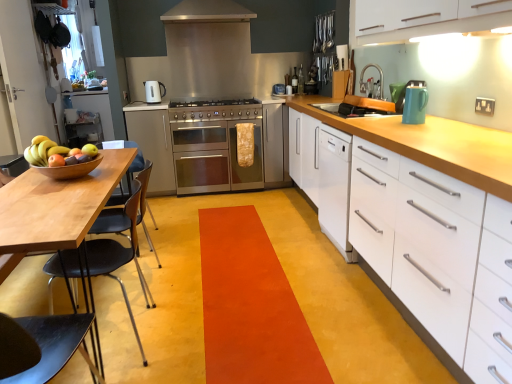
Image resolution: width=512 pixels, height=384 pixels. Identify the location of white matte cabinet at right, positioned as the first cabinetry in right-to-left order. (432, 144).

Image resolution: width=512 pixels, height=384 pixels. Describe the element at coordinates (432, 144) in the screenshot. I see `white matte cabinet at right, the 3th cabinetry from the left` at that location.

What do you see at coordinates (153, 144) in the screenshot?
I see `stainless steel oven at center, placed as the second cabinetry when sorted from front to back` at bounding box center [153, 144].

What is the approximate width of brushed metal faucet at upper center?

brushed metal faucet at upper center is 6.43 inches in width.

Find the location of `white matte cabinet at right, the 3th cabinetry from the left`. white matte cabinet at right, the 3th cabinetry from the left is located at coordinates (432, 144).

Which of these two, white matte dishwasher at center-right or white matte cabinet at right, positioned as the 3th cabinetry in back-to-front order, is smaller?

Smaller between the two is white matte dishwasher at center-right.

How many degrees apart are the facing directions of white matte dishwasher at center-right and white matte cabinet at right, the 3th cabinetry from the left?

white matte dishwasher at center-right and white matte cabinet at right, the 3th cabinetry from the left, are facing 0.000287 degrees away from each other.

Does point (319, 208) appear closer or farther from the camera than point (446, 359)?

Point (319, 208).

What's the angular difference between white glossy electric kettle at upper center, which ranks as the second kitchen appliance in bottom-to-top order, and black plastic chair at left's facing directions?

white glossy electric kettle at upper center, which ranks as the second kitchen appliance in bottom-to-top order, and black plastic chair at left are facing 91.6 degrees away from each other.

The image size is (512, 384). I want to click on chair below the white glossy electric kettle at upper center, which is the 2th kitchen appliance in front-to-back order (from the image's perspective), so click(x=118, y=253).

From the image's perspective, is white glossy electric kettle at upper center, the first kitchen appliance from the left, on black plastic chair at left?

Yes, from the image's perspective, white glossy electric kettle at upper center, the first kitchen appliance from the left, is above black plastic chair at left.

Does orange carpet at center have a larger size compared to teal glossy kettle at upper right, the 2th kitchen appliance positioned from the top?

Indeed, orange carpet at center has a larger size compared to teal glossy kettle at upper right, the 2th kitchen appliance positioned from the top.

Measure the distance from orange carpet at center to teal glossy kettle at upper right, positioned as the first kitchen appliance in bottom-to-top order.

4.42 feet.

Could you tell me if orange carpet at center is facing teal glossy kettle at upper right, which is counted as the first kitchen appliance, starting from the right?

No, orange carpet at center is not oriented towards teal glossy kettle at upper right, which is counted as the first kitchen appliance, starting from the right.

Find the location of a particular element. This screenshot has height=384, width=512. the 1st kitchen appliance above when counting from the orange carpet at center (from the image's perspective) is located at coordinates (415, 102).

In the image, there is a white glossy electric kettle at upper center, which ranks as the second kitchen appliance in bottom-to-top order. At what (x,y) coordinates should I click in order to perform the action: click on sink below it (from the image's perspective). Please return your answer as a coordinate pair (x, y). Looking at the image, I should click on (358, 107).

Is wooden cutting board at upper right oriented away from white glossy electric kettle at upper center, which appears as the 1th kitchen appliance when viewed from the top?

No, wooden cutting board at upper right's orientation is not away from white glossy electric kettle at upper center, which appears as the 1th kitchen appliance when viewed from the top.

Which of these two, wooden cutting board at upper right or white glossy electric kettle at upper center, the first kitchen appliance from the left, is thinner?

Thinner between the two is white glossy electric kettle at upper center, the first kitchen appliance from the left.

Would you consider wooden cutting board at upper right to be distant from white glossy electric kettle at upper center, which is the 2th kitchen appliance in front-to-back order?

Yes.

Considering the sizes of objects wooden bowl at left and white matte cabinet at right, positioned as the 3th cabinetry in back-to-front order, in the image provided, who is shorter, wooden bowl at left or white matte cabinet at right, positioned as the 3th cabinetry in back-to-front order,?

wooden bowl at left is shorter.

From the image's perspective, which one is positioned lower, wooden bowl at left or white matte cabinet at right, positioned as the 3th cabinetry in back-to-front order?

white matte cabinet at right, positioned as the 3th cabinetry in back-to-front order, is shown below in the image.

Based on the photo, is wooden bowl at left aimed at white matte cabinet at right, the 3th cabinetry from the left?

Yes, wooden bowl at left is aimed at white matte cabinet at right, the 3th cabinetry from the left.

Are wooden bowl at left and white matte cabinet at right, positioned as the 3th cabinetry in back-to-front order, far apart?

Yes, wooden bowl at left and white matte cabinet at right, positioned as the 3th cabinetry in back-to-front order, are located far from each other.

How many degrees apart are the facing directions of teal glossy kettle at upper right, the 1th kitchen appliance in the front-to-back sequence, and wooden cutting board at upper right?

There is a 0.00101-degree angle between the facing directions of teal glossy kettle at upper right, the 1th kitchen appliance in the front-to-back sequence, and wooden cutting board at upper right.

Does teal glossy kettle at upper right, the 1th kitchen appliance in the front-to-back sequence, have a lesser width compared to wooden cutting board at upper right?

Indeed, teal glossy kettle at upper right, the 1th kitchen appliance in the front-to-back sequence, has a lesser width compared to wooden cutting board at upper right.

Is teal glossy kettle at upper right, positioned as the first kitchen appliance in bottom-to-top order, to the left or to the right of wooden cutting board at upper right in the image?

From the image, it's evident that teal glossy kettle at upper right, positioned as the first kitchen appliance in bottom-to-top order, is to the right of wooden cutting board at upper right.

Considering the sizes of objects teal glossy kettle at upper right, acting as the second kitchen appliance starting from the left, and wooden cutting board at upper right in the image provided, who is taller, teal glossy kettle at upper right, acting as the second kitchen appliance starting from the left, or wooden cutting board at upper right?

teal glossy kettle at upper right, acting as the second kitchen appliance starting from the left, is taller.

Which object is further away from the camera taking this photo, stainless steel oven at center or stainless steel gas stove at center?

stainless steel oven at center is further away from the camera.

Is stainless steel oven at center aimed at stainless steel gas stove at center?

No, stainless steel oven at center is not turned towards stainless steel gas stove at center.

Considering the sizes of stainless steel oven at center and stainless steel gas stove at center in the image, is stainless steel oven at center taller or shorter than stainless steel gas stove at center?

Considering their sizes, stainless steel oven at center has more height than stainless steel gas stove at center.

Can you tell me how much stainless steel oven at center and stainless steel gas stove at center differ in facing direction?

0.495 degrees separate the facing orientations of stainless steel oven at center and stainless steel gas stove at center.

Where is `cabinetry in front of the white matte dishwasher at center-right`? cabinetry in front of the white matte dishwasher at center-right is located at coordinates (x=432, y=144).

Where is `the 2nd kitchen appliance directly above the black plastic chair at left (from a real-world perspective)`? the 2nd kitchen appliance directly above the black plastic chair at left (from a real-world perspective) is located at coordinates (154, 91).

When comparing their distances from teal glossy kettle at upper right, the 2th kitchen appliance positioned from the top, does white matte dishwasher at center-right or white glossy electric kettle at upper center, which ranks as the second kitchen appliance in bottom-to-top order, seem closer?

white matte dishwasher at center-right.

Estimate the real-world distances between objects in this image. Which object is closer to white matte dishwasher at center-right, shiny wooden bowl at left or black plastic chair at left?

The object closer to white matte dishwasher at center-right is black plastic chair at left.

When comparing their distances from teal glossy kettle at upper right, which is counted as the first kitchen appliance, starting from the right, does stainless steel gas stove at center or white glossy electric kettle at upper center, which ranks as the second kitchen appliance in bottom-to-top order, seem closer?

stainless steel gas stove at center is positioned closer to the anchor teal glossy kettle at upper right, which is counted as the first kitchen appliance, starting from the right.

From the image, which object appears to be nearer to brushed metal faucet at upper center, teal glossy kettle at upper right, the 1th kitchen appliance in the front-to-back sequence, or wooden bowl at left?

teal glossy kettle at upper right, the 1th kitchen appliance in the front-to-back sequence, lies closer to brushed metal faucet at upper center than the other object.

Looking at the image, which one is located further to black plastic chair at left, white matte dishwasher at center-right or white glossy cabinet at upper left, acting as the third cabinetry starting from the front?

The object further to black plastic chair at left is white glossy cabinet at upper left, acting as the third cabinetry starting from the front.

When comparing their distances from black plastic chair at left, does white glossy electric kettle at upper center, placed as the 2th kitchen appliance when sorted from right to left, or white matte cabinet at right, which ranks as the 1th cabinetry in front-to-back order, seem closer?

white matte cabinet at right, which ranks as the 1th cabinetry in front-to-back order, lies closer to black plastic chair at left than the other object.

Which object lies further to the anchor point white glossy electric kettle at upper center, placed as the 2th kitchen appliance when sorted from right to left, wooden bowl at left or white matte dishwasher at center-right?

Based on the image, white matte dishwasher at center-right appears to be further to white glossy electric kettle at upper center, placed as the 2th kitchen appliance when sorted from right to left.

From the image, which object appears to be nearer to white glossy cabinet at upper left, which ranks as the 3th cabinetry in right-to-left order, stainless steel gas stove at center or white glossy electric kettle at upper center, which is the 2th kitchen appliance in front-to-back order?

white glossy electric kettle at upper center, which is the 2th kitchen appliance in front-to-back order, is closer to white glossy cabinet at upper left, which ranks as the 3th cabinetry in right-to-left order.

The width and height of the screenshot is (512, 384). I want to click on file cabinet located between shiny wooden bowl at left and stainless steel oven at center in the depth direction, so click(x=335, y=188).

Find the location of a particular element. The image size is (512, 384). oven between shiny wooden bowl at left and white glossy cabinet at upper left, acting as the third cabinetry starting from the front, from front to back is located at coordinates (214, 157).

Where is `chair positioned between white matte cabinet at right, positioned as the 3th cabinetry in back-to-front order, and stainless steel gas stove at center from near to far`? This screenshot has width=512, height=384. chair positioned between white matte cabinet at right, positioned as the 3th cabinetry in back-to-front order, and stainless steel gas stove at center from near to far is located at coordinates (118, 253).

This screenshot has height=384, width=512. Identify the location of kitchen appliance between brushed metal faucet at upper center and white matte dishwasher at center-right vertically. (415, 102).